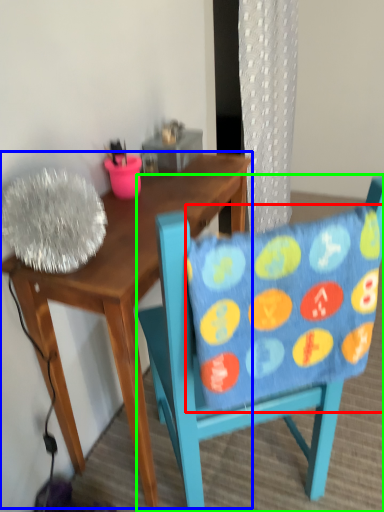
Question: Which object is positioned farthest from pillow (highlighted by a red box)? Select from desk (highlighted by a blue box) and chair (highlighted by a green box).

Choices:
 (A) desk
 (B) chair

Answer: (A)